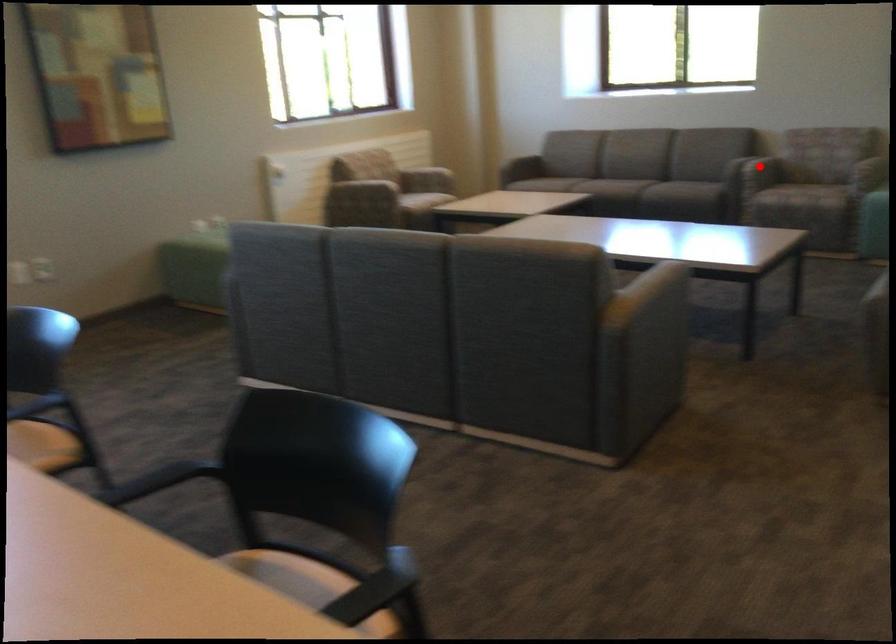
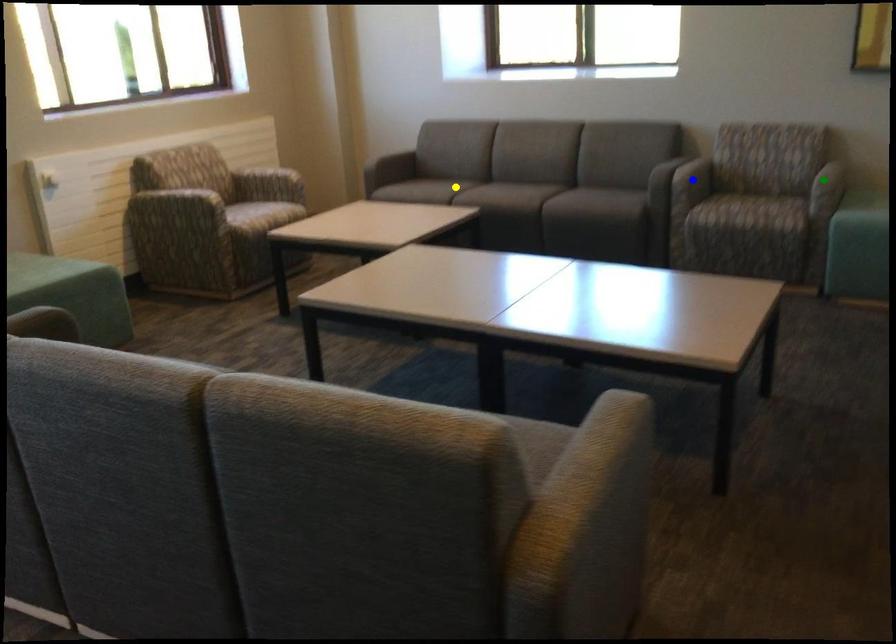
Question: I am providing you with two images of the same scene from different viewpoints. A red point is marked on the first image. You are given multiple points on the second image. In image 2, which mark is for the same physical point as the one in image 1?

Choices:
 (A) yellow point
 (B) green point
 (C) blue point

Answer: (C)